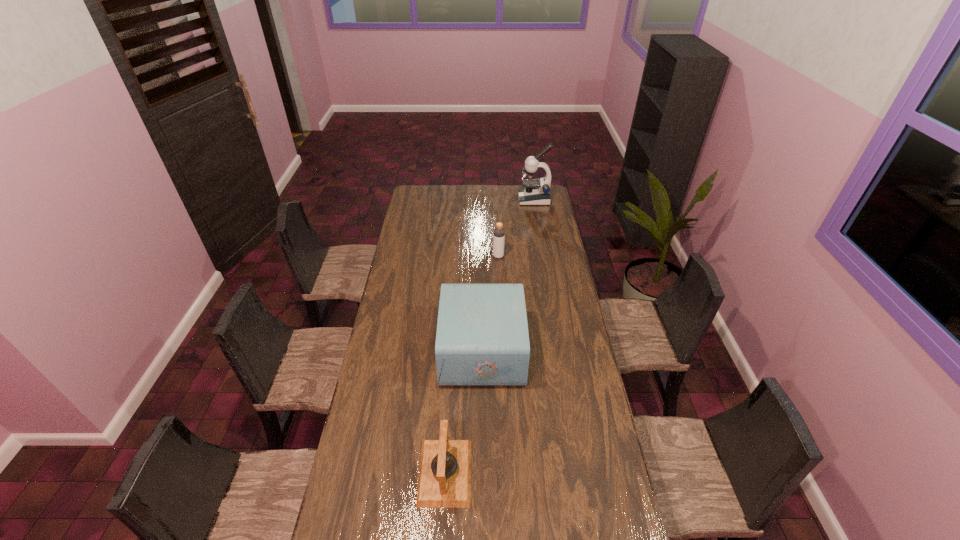
Where is `vacant space located on the front panel of the radio receiver`? vacant space located on the front panel of the radio receiver is located at coordinates (395, 350).

In order to click on vacant space situated on the front panel of the radio receiver in this screenshot , I will do `click(398, 350)`.

You are a GUI agent. You are given a task and a screenshot of the screen. Output one action in this format:
    pyautogui.click(x=<x>, y=<y>)
    Task: Click on the vacant space located 0.210m on the front of the bottle
    
    Given the screenshot: What is the action you would take?
    pyautogui.click(x=500, y=286)

At what (x,y) coordinates should I click in order to perform the action: click on vacant space situated on the right of the nearest object. Please return your answer as a coordinate pair (x, y). Looking at the image, I should click on (564, 472).

The height and width of the screenshot is (540, 960). I want to click on object at the far edge, so click(x=535, y=192).

The image size is (960, 540). Identify the location of object at the right edge. (535, 192).

In order to click on object that is at the far right corner in this screenshot , I will do `click(535, 192)`.

In the image, there is a desktop. Identify the location of vacant area at the left edge. (404, 335).

Where is `free point at the right edge`? free point at the right edge is located at coordinates (557, 333).

In the image, there is a desktop. Identify the location of vacant area at the far left corner. The width and height of the screenshot is (960, 540). (421, 185).